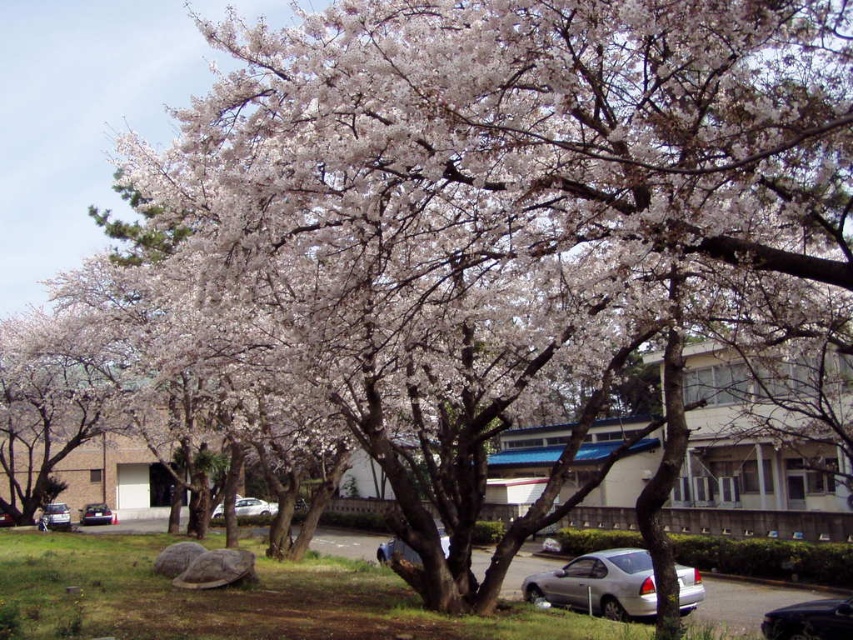
Who is shorter, silver metallic car at lower center or metallic silver sedan at center?

silver metallic car at lower center

Does silver metallic car at lower center have a greater width compared to metallic silver sedan at center?

No.

Between point (642, 579) and point (392, 556), which one is positioned behind?

Positioned behind is point (642, 579).

Locate an element on the screen. The image size is (853, 640). silver metallic car at lower center is located at coordinates click(599, 584).

Which of these two, metallic silver sedan at center or silver metallic sedan at lower left, stands shorter?

silver metallic sedan at lower left

Measure the distance between metallic silver sedan at center and camera.

metallic silver sedan at center is 11.90 meters from camera.

Who is more forward, (381,552) or (64,520)?

Point (381,552) is more forward.

This screenshot has width=853, height=640. Identify the location of metallic silver sedan at center. (396, 552).

Is silver metallic car at center below matte black sedan at lower left?

Incorrect, silver metallic car at center is not positioned below matte black sedan at lower left.

Is silver metallic car at center bigger than matte black sedan at lower left?

Indeed, silver metallic car at center has a larger size compared to matte black sedan at lower left.

What do you see at coordinates (253, 508) in the screenshot?
I see `silver metallic car at center` at bounding box center [253, 508].

At what (x,y) coordinates should I click in order to perform the action: click on silver metallic car at center. Please return your answer as a coordinate pair (x, y). This screenshot has width=853, height=640. Looking at the image, I should click on (253, 508).